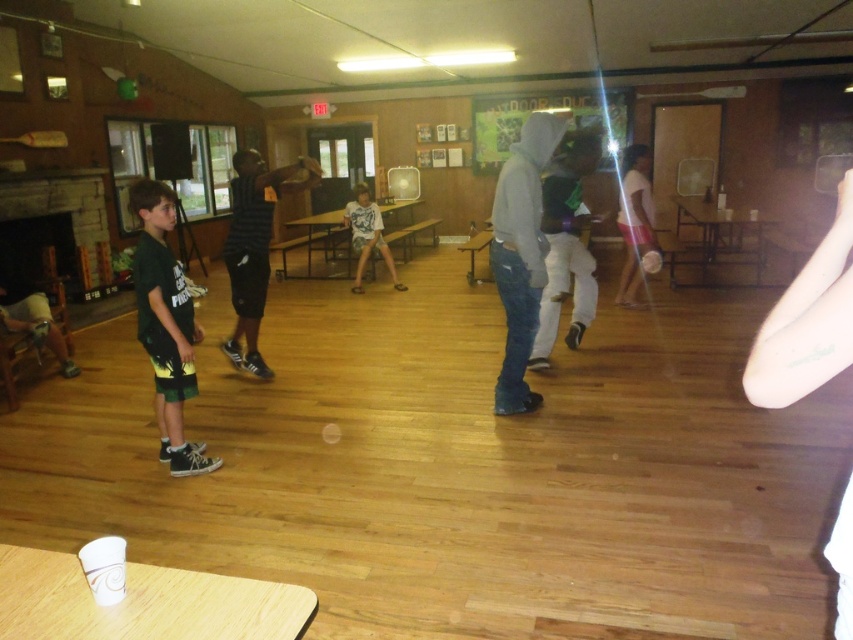
Which is above, black mesh shirt at center or white matte shirt at center?

white matte shirt at center is above.

Who is lower down, black mesh shirt at center or white matte shirt at center?

black mesh shirt at center is below.

Does point (311, 179) lie behind point (631, 198)?

No.

This screenshot has width=853, height=640. I want to click on black mesh shirt at center, so click(x=254, y=248).

Can you confirm if green fabric shorts at left is smaller than white cotton shirt at center?

Correct, green fabric shorts at left occupies less space than white cotton shirt at center.

Is green fabric shorts at left to the right of white cotton shirt at center from the viewer's perspective?

In fact, green fabric shorts at left is to the left of white cotton shirt at center.

What do you see at coordinates (166, 326) in the screenshot?
I see `green fabric shorts at left` at bounding box center [166, 326].

Locate an element on the screen. green fabric shorts at left is located at coordinates (166, 326).

Can you confirm if green fabric shorts at left is positioned to the right of white matte shirt at center?

Incorrect, green fabric shorts at left is not on the right side of white matte shirt at center.

This screenshot has width=853, height=640. What do you see at coordinates (166, 326) in the screenshot?
I see `green fabric shorts at left` at bounding box center [166, 326].

Where is `green fabric shorts at left`? green fabric shorts at left is located at coordinates (166, 326).